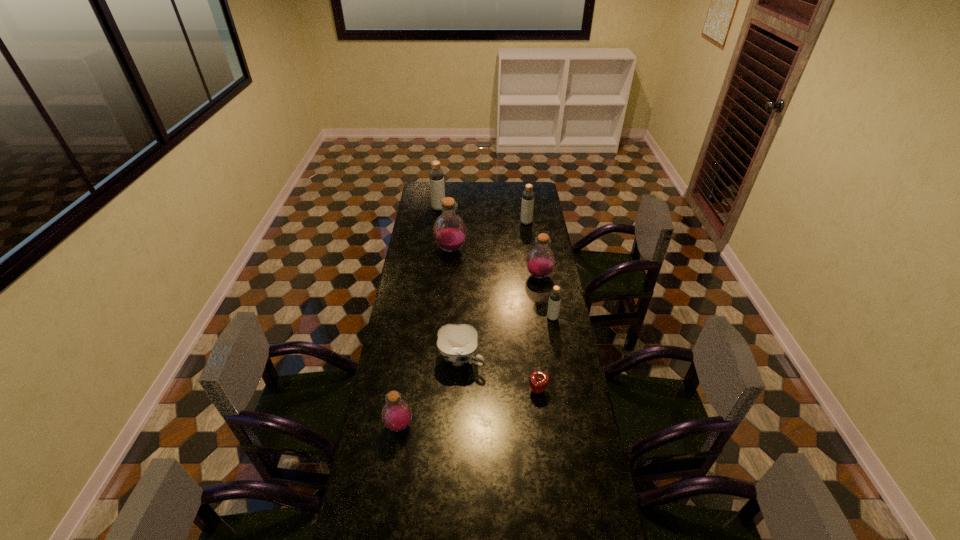
Locate an element on the screen. The height and width of the screenshot is (540, 960). the farthest bottle is located at coordinates (436, 175).

Identify the location of the leftmost gray bottle. (436, 175).

Where is `the farthest purple bottle`? This screenshot has height=540, width=960. the farthest purple bottle is located at coordinates (449, 231).

You are a GUI agent. You are given a task and a screenshot of the screen. Output one action in this format:
    pyautogui.click(x=<x>, y=<y>)
    Task: Click on the biggest purple bottle
    The width and height of the screenshot is (960, 540).
    Given the screenshot: What is the action you would take?
    coord(449,231)

The image size is (960, 540). Identify the location of the seventh nearest object. [527, 205].

Identify the location of the second farthest bottle. The height and width of the screenshot is (540, 960). (527, 205).

Find the location of a particular element. the rightmost purple bottle is located at coordinates (540, 262).

Where is `the second farthest purple bottle`? This screenshot has width=960, height=540. the second farthest purple bottle is located at coordinates (540, 262).

Identify the location of the smallest gray bottle. The width and height of the screenshot is (960, 540). (555, 295).

The height and width of the screenshot is (540, 960). In order to click on the nearest gray bottle in this screenshot , I will do `click(555, 295)`.